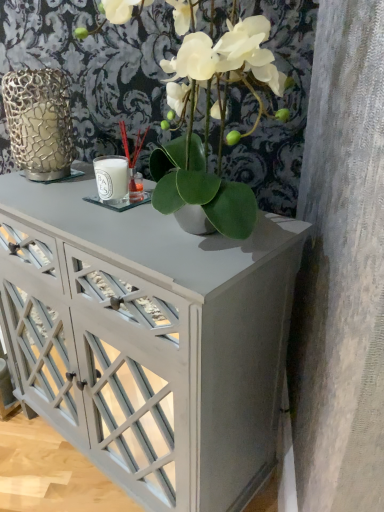
In order to click on gold textured vase at left in this screenshot , I will do `click(39, 122)`.

What do you see at coordinates (39, 122) in the screenshot? The height and width of the screenshot is (512, 384). I see `gold textured vase at left` at bounding box center [39, 122].

The height and width of the screenshot is (512, 384). Describe the element at coordinates (149, 339) in the screenshot. I see `white glossy cabinet at center` at that location.

Identify the location of green matte plant at center. The image size is (384, 512). [209, 121].

Would you consider green matte plant at center to be distant from white glossy cabinet at center?

No, green matte plant at center is not far away from white glossy cabinet at center.

Is green matte plant at center not inside white glossy cabinet at center?

green matte plant at center is positioned outside white glossy cabinet at center.

Who is smaller, green matte plant at center or white glossy cabinet at center?

green matte plant at center is smaller.

From a real-world perspective, is green matte plant at center positioned above or below white glossy cabinet at center?

In terms of real-world spatial position, green matte plant at center is above white glossy cabinet at center.

Is the depth of green matte plant at center greater than that of gold textured vase at left?

That is False.

Which is correct: green matte plant at center is inside gold textured vase at left, or outside of it?

green matte plant at center cannot be found inside gold textured vase at left.

The height and width of the screenshot is (512, 384). In order to click on houseplant on the right of gold textured vase at left in this screenshot , I will do `click(209, 121)`.

From a real-world perspective, is green matte plant at center positioned above or below gold textured vase at left?

Clearly, from a real-world perspective, green matte plant at center is above gold textured vase at left.

Is white glossy cabinet at center turned away from gold textured vase at left?

No, white glossy cabinet at center is not facing the opposite direction of gold textured vase at left.

Would you say white glossy cabinet at center is outside gold textured vase at left?

Yes, white glossy cabinet at center is not within gold textured vase at left.

From the image's perspective, is white glossy cabinet at center positioned above or below gold textured vase at left?

Based on their image positions, white glossy cabinet at center is located beneath gold textured vase at left.

Can you confirm if white glossy cabinet at center is positioned to the right of gold textured vase at left?

Yes.

Is gold textured vase at left positioned with its back to green matte plant at center?

No, gold textured vase at left is not facing the opposite direction of green matte plant at center.

From their relative heights in the image, would you say gold textured vase at left is taller or shorter than green matte plant at center?

gold textured vase at left is shorter than green matte plant at center.

The height and width of the screenshot is (512, 384). I want to click on glass vase located behind the green matte plant at center, so click(x=39, y=122).

Would you say gold textured vase at left is outside green matte plant at center?

gold textured vase at left is positioned outside green matte plant at center.

How far apart are gold textured vase at left and white glossy cabinet at center?

17.64 inches.

Which of these two, gold textured vase at left or white glossy cabinet at center, is wider?

With larger width is white glossy cabinet at center.

Identify the location of table on the right of the gold textured vase at left. The width and height of the screenshot is (384, 512). (149, 339).

Considering the points (41, 121) and (113, 376), which point is in front, point (41, 121) or point (113, 376)?

The point (113, 376) is closer to the camera.

Considering the sizes of objects white glossy cabinet at center and green matte plant at center in the image provided, who is wider, white glossy cabinet at center or green matte plant at center?

With larger width is green matte plant at center.

Which point is more distant from viewer, (254, 434) or (233, 182)?

The point (254, 434) is farther from the camera.

Which object is positioned more to the left, white glossy cabinet at center or green matte plant at center?

white glossy cabinet at center.

Can we say white glossy cabinet at center lies outside green matte plant at center?

Yes, white glossy cabinet at center is located beyond the bounds of green matte plant at center.

Where is `table beneath the green matte plant at center (from a real-world perspective)`? The image size is (384, 512). table beneath the green matte plant at center (from a real-world perspective) is located at coordinates (149, 339).

Locate an element on the screen. This screenshot has width=384, height=512. glass vase located on the left of green matte plant at center is located at coordinates (39, 122).

From the image, which object appears to be farther from white glossy cabinet at center, gold textured vase at left or green matte plant at center?

gold textured vase at left lies further to white glossy cabinet at center than the other object.

When comparing their distances from green matte plant at center, does gold textured vase at left or white glossy cabinet at center seem closer?

white glossy cabinet at center is positioned closer to the anchor green matte plant at center.

Considering their positions, is green matte plant at center positioned closer to white glossy cabinet at center than gold textured vase at left?

green matte plant at center is positioned closer to the anchor white glossy cabinet at center.

Considering their positions, is white glossy cabinet at center positioned further to green matte plant at center than gold textured vase at left?

gold textured vase at left.

Looking at the image, which one is located closer to gold textured vase at left, green matte plant at center or white glossy cabinet at center?

Among the two, green matte plant at center is located nearer to gold textured vase at left.

Based on their spatial positions, is white glossy cabinet at center or green matte plant at center closer to gold textured vase at left?

green matte plant at center is closer to gold textured vase at left.

Identify the location of houseplant between gold textured vase at left and white glossy cabinet at center from top to bottom. (209, 121).